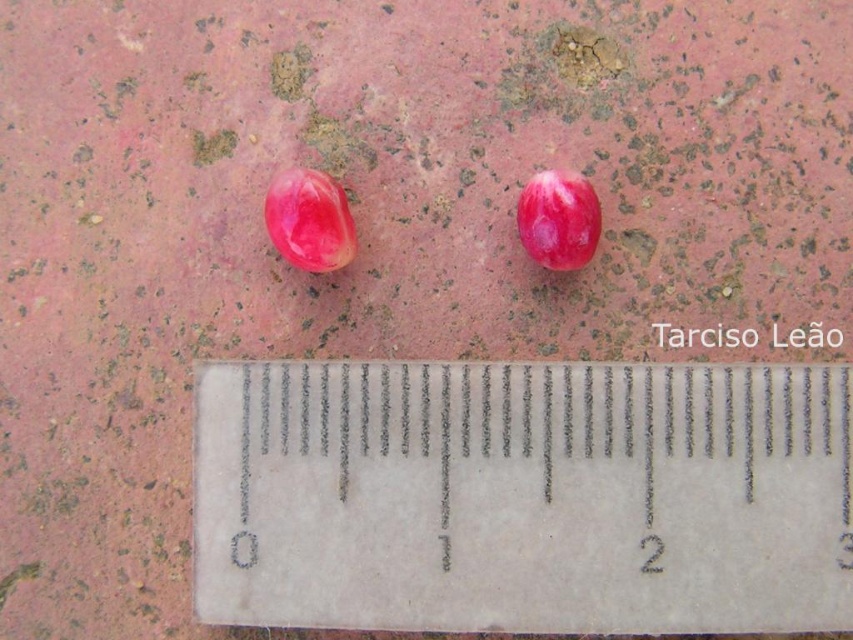
Question: Which is farther from the glossy pink fruit at center?

Choices:
 (A) transparent plastic ruler at center
 (B) glossy pink seed at center

Answer: (A)

Question: Can you confirm if transparent plastic ruler at center is positioned above glossy pink seed at center?

Choices:
 (A) yes
 (B) no

Answer: (B)

Question: Which of the following is the closest to the observer?

Choices:
 (A) (540, 209)
 (B) (306, 260)
 (C) (735, 483)

Answer: (C)

Question: In this image, where is transparent plastic ruler at center located relative to glossy pink fruit at center?

Choices:
 (A) below
 (B) above

Answer: (A)

Question: Can you confirm if transparent plastic ruler at center is positioned to the left of glossy pink seed at center?

Choices:
 (A) no
 (B) yes

Answer: (A)

Question: Which object is positioned farthest from the transparent plastic ruler at center?

Choices:
 (A) glossy pink fruit at center
 (B) glossy pink seed at center

Answer: (B)